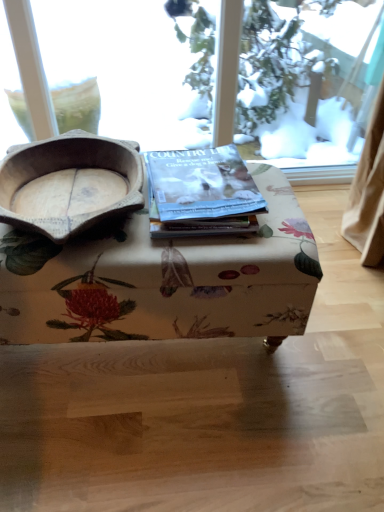
Question: In the image, is matte paper magazine at center on the left side or the right side of floral fabric ottoman at center?

Choices:
 (A) left
 (B) right

Answer: (B)

Question: In terms of size, does matte paper magazine at center appear bigger or smaller than floral fabric ottoman at center?

Choices:
 (A) big
 (B) small

Answer: (B)

Question: Which of these objects is positioned farthest from the matte paper magazine at center?

Choices:
 (A) floral fabric ottoman at center
 (B) wooden bowl at left

Answer: (B)

Question: Which object is positioned closest to the floral fabric ottoman at center?

Choices:
 (A) matte paper magazine at center
 (B) wooden bowl at left

Answer: (A)